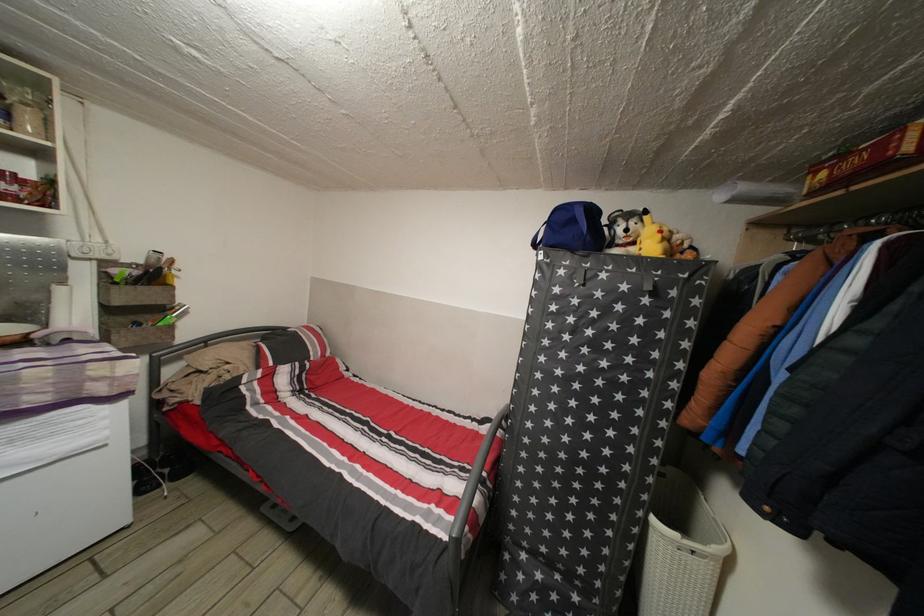
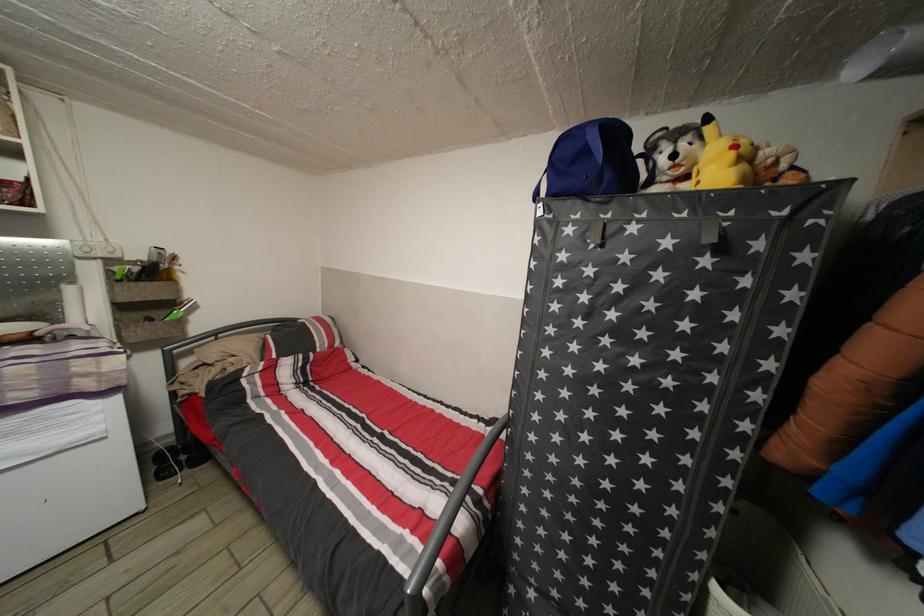
The point at (665, 243) is marked in the first image. Where is the corresponding point in the second image?

(738, 161)